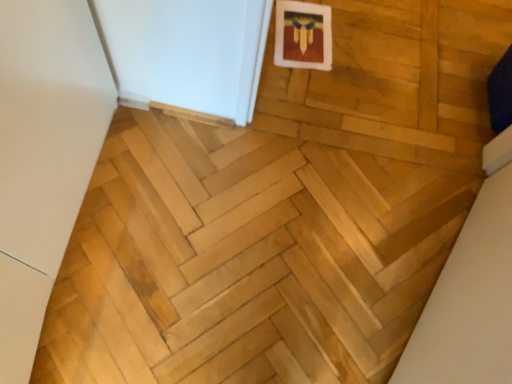
What do you see at coordinates (303, 35) in the screenshot? The height and width of the screenshot is (384, 512). I see `wooden picture frame at upper center` at bounding box center [303, 35].

The image size is (512, 384). In order to click on wooden picture frame at upper center in this screenshot , I will do `click(303, 35)`.

Locate an element on the screen. The height and width of the screenshot is (384, 512). wooden picture frame at upper center is located at coordinates (303, 35).